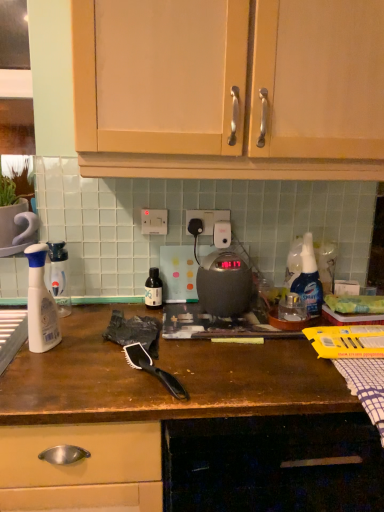
Identify the location of free spot in front of white plastic spray bottle at left, which is the second bottle in right-to-left order. Image resolution: width=384 pixels, height=512 pixels. (59, 335).